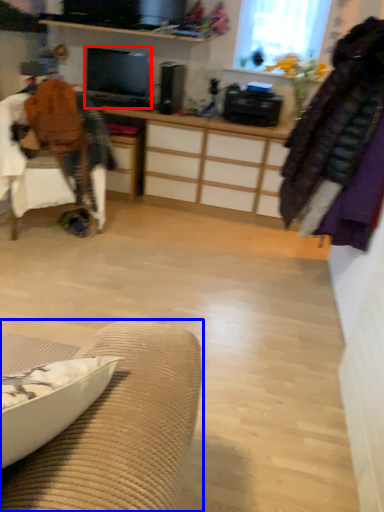
Question: Which of the following is the closest to the observer, television (highlighted by a red box) or furniture (highlighted by a blue box)?

Choices:
 (A) television
 (B) furniture

Answer: (B)